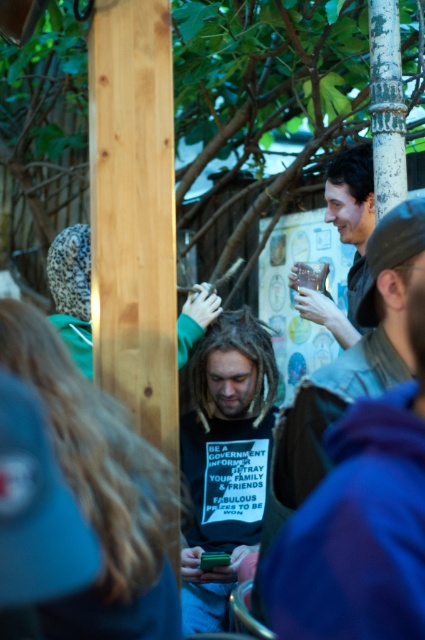
Question: Is black matte t-shirt at center bigger than dark brown leather jacket at center?

Choices:
 (A) no
 (B) yes

Answer: (B)

Question: Estimate the real-world distances between objects in this image. Which object is closer to the dark brown leather jacket at center?

Choices:
 (A) white textured pole at upper right
 (B) black matte t-shirt at center

Answer: (B)

Question: Which object is farther from the camera taking this photo?

Choices:
 (A) dark brown leather jacket at center
 (B) black matte t-shirt at center
 (C) white textured pole at upper right

Answer: (C)

Question: Does black matte t-shirt at center appear over white textured pole at upper right?

Choices:
 (A) yes
 (B) no

Answer: (B)

Question: Does dark brown leather jacket at center have a smaller size compared to smooth brown leather jacket at upper right?

Choices:
 (A) no
 (B) yes

Answer: (B)

Question: Which of the following is the closest to the observer?

Choices:
 (A) white textured pole at upper right
 (B) black matte t-shirt at center
 (C) smooth brown leather jacket at upper right
 (D) dark brown leather jacket at center

Answer: (D)